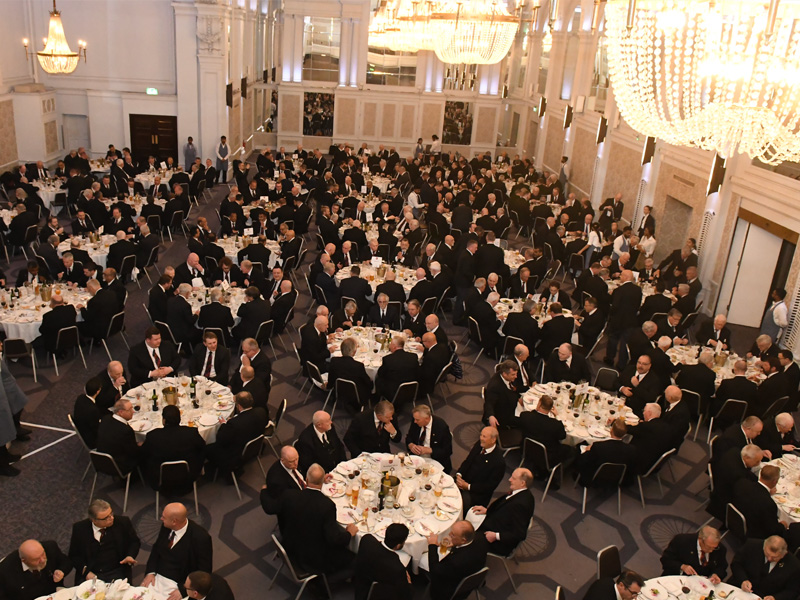
Locate an element on the screen. This screenshot has height=600, width=800. bottles is located at coordinates (153, 400), (189, 386), (381, 483).